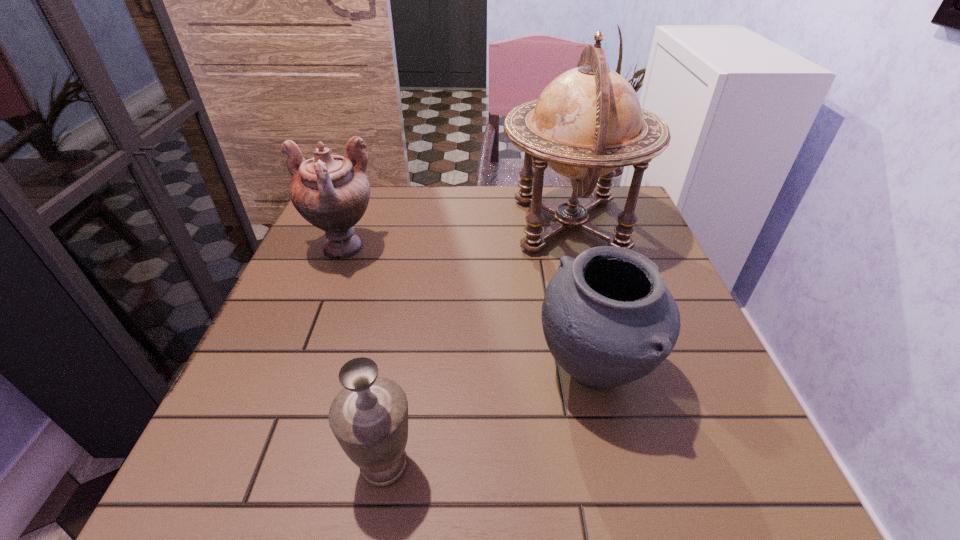
Image resolution: width=960 pixels, height=540 pixels. I want to click on the tallest object, so click(x=588, y=121).

The image size is (960, 540). Identify the location of the farthest urn. (332, 192).

The image size is (960, 540). What are the coordinates of `the leftmost urn` in the screenshot? It's located at click(332, 192).

Locate an element on the screen. The image size is (960, 540). the third farthest object is located at coordinates (608, 318).

Find the location of a particular element. The image size is (960, 540). the rightmost urn is located at coordinates (608, 318).

Locate an element on the screen. This screenshot has width=960, height=540. the nearest object is located at coordinates (369, 417).

Where is `the second object from left to right`? The width and height of the screenshot is (960, 540). the second object from left to right is located at coordinates (369, 417).

Locate an element on the screen. vacant region located on the front-facing side of the globe is located at coordinates (396, 224).

The width and height of the screenshot is (960, 540). In order to click on free space located on the front-facing side of the globe in this screenshot , I will do `click(411, 224)`.

At what (x,y) coordinates should I click in order to perform the action: click on blank area located on the front-facing side of the globe. Please return your answer as a coordinate pair (x, y). The image size is (960, 540). Looking at the image, I should click on (457, 224).